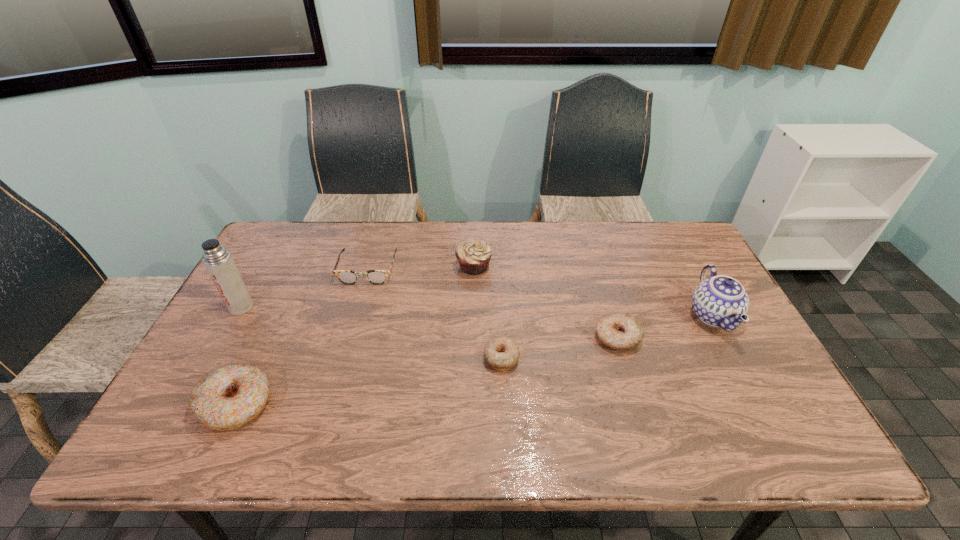
To achieve even spacing by inserting another doughnut among them, please point to a vacant spot for this new doughnut. Please provide its 2D coordinates. Your answer should be formatted as a tuple, i.e. [(x, y)], where the tuple contains the x and y coordinates of a point satisfying the conditions above.

[(374, 380)]